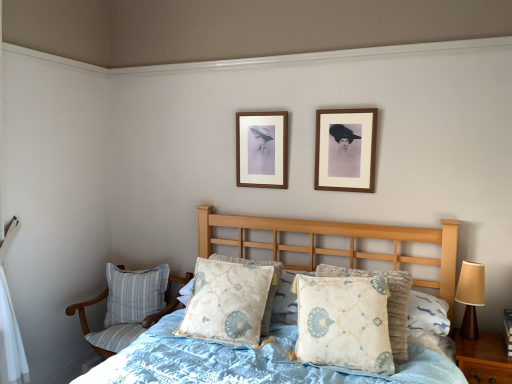
Find the location of a particular element. This screenshot has height=384, width=512. floral-patterned fabric pillow at center, which appears as the 1th pillow when viewed from the right is located at coordinates (344, 322).

The height and width of the screenshot is (384, 512). What do you see at coordinates (345, 149) in the screenshot? I see `wooden picture frame at upper center, the 1th picture frame from the right` at bounding box center [345, 149].

The height and width of the screenshot is (384, 512). What do you see at coordinates (129, 305) in the screenshot? I see `striped fabric chair at lower left` at bounding box center [129, 305].

Measure the distance between light blue quilted bed at center and camera.

They are 5.30 feet apart.

The image size is (512, 384). I want to click on floral-patterned fabric pillow at center, which appears as the 1th pillow when viewed from the right, so click(x=344, y=322).

From the image's perspective, is floral-patterned fabric pillow at center, the 2th pillow viewed from the back, on top of wooden picture frame at upper center, the 2th picture frame in the right-to-left sequence?

No, from the image's perspective, floral-patterned fabric pillow at center, the 2th pillow viewed from the back, is not on top of wooden picture frame at upper center, the 2th picture frame in the right-to-left sequence.

From a real-world perspective, is floral-patterned fabric pillow at center, the second pillow from the right, physically located above or below wooden picture frame at upper center, the 2th picture frame in the right-to-left sequence?

From a real-world perspective, floral-patterned fabric pillow at center, the second pillow from the right, is physically below wooden picture frame at upper center, the 2th picture frame in the right-to-left sequence.

Considering the relative positions of floral-patterned fabric pillow at center, the 2th pillow from the front, and wooden picture frame at upper center, the 1th picture frame viewed from the left, in the image provided, is floral-patterned fabric pillow at center, the 2th pillow from the front, behind wooden picture frame at upper center, the 1th picture frame viewed from the left,?

No, the depth of floral-patterned fabric pillow at center, the 2th pillow from the front, is less than that of wooden picture frame at upper center, the 1th picture frame viewed from the left.

Considering the sizes of objects floral-patterned fabric pillow at center, the 2th pillow from the front, and wooden picture frame at upper center, the second picture frame when ordered from front to back, in the image provided, who is thinner, floral-patterned fabric pillow at center, the 2th pillow from the front, or wooden picture frame at upper center, the second picture frame when ordered from front to back,?

With smaller width is wooden picture frame at upper center, the second picture frame when ordered from front to back.

Considering the relative sizes of wooden picture frame at upper center, placed as the first picture frame when sorted from back to front, and floral-patterned fabric pillow at center, the 2th pillow positioned from the left, in the image provided, is wooden picture frame at upper center, placed as the first picture frame when sorted from back to front, shorter than floral-patterned fabric pillow at center, the 2th pillow positioned from the left,?

In fact, wooden picture frame at upper center, placed as the first picture frame when sorted from back to front, may be taller than floral-patterned fabric pillow at center, the 2th pillow positioned from the left.

You are a GUI agent. You are given a task and a screenshot of the screen. Output one action in this format:
    pyautogui.click(x=<x>, y=<y>)
    Task: Click on the 1st pillow in front when counting from the wooden picture frame at upper center, the 2th picture frame in the right-to-left sequence
    The width and height of the screenshot is (512, 384).
    Given the screenshot: What is the action you would take?
    pyautogui.click(x=227, y=302)

Is there a large distance between wooden picture frame at upper center, the second picture frame when ordered from front to back, and floral-patterned fabric pillow at center, the 2th pillow positioned from the left?

Actually, wooden picture frame at upper center, the second picture frame when ordered from front to back, and floral-patterned fabric pillow at center, the 2th pillow positioned from the left, are a little close together.

Which object is positioned more to the right, light blue quilted bed at center or floral-patterned fabric pillow at center, the second pillow from the right?

From the viewer's perspective, light blue quilted bed at center appears more on the right side.

Locate an element on the screen. This screenshot has height=384, width=512. bed below the floral-patterned fabric pillow at center, the second pillow from the right (from the image's perspective) is located at coordinates (245, 362).

Between light blue quilted bed at center and floral-patterned fabric pillow at center, the second pillow from the right, which one is positioned in front?

light blue quilted bed at center is closer to the camera.

Is light blue quilted bed at center looking in the opposite direction of floral-patterned fabric pillow at center, the 2th pillow viewed from the back?

Yes, light blue quilted bed at center's orientation is away from floral-patterned fabric pillow at center, the 2th pillow viewed from the back.

Is striped fabric chair at lower left next to brown matte table lamp at right?

striped fabric chair at lower left is not next to brown matte table lamp at right, and they're not touching.

Is point (146, 323) behind point (460, 277)?

That is True.

Which object is positioned more to the right, striped fabric chair at lower left or brown matte table lamp at right?

From the viewer's perspective, brown matte table lamp at right appears more on the right side.

Looking at this image, is wooden picture frame at upper center, acting as the second picture frame starting from the left, to the right of striped fabric chair at lower left from the viewer's perspective?

Yes, wooden picture frame at upper center, acting as the second picture frame starting from the left, is to the right of striped fabric chair at lower left.

Are wooden picture frame at upper center, which is the first picture frame from front to back, and striped fabric chair at lower left beside each other?

No, wooden picture frame at upper center, which is the first picture frame from front to back, is not making contact with striped fabric chair at lower left.

Could you tell me if wooden picture frame at upper center, which is the first picture frame from front to back, is turned towards striped fabric chair at lower left?

No, wooden picture frame at upper center, which is the first picture frame from front to back, is not aimed at striped fabric chair at lower left.

Between wooden picture frame at upper center, which is the first picture frame from front to back, and striped fabric chair at lower left, which one has larger size?

striped fabric chair at lower left is bigger.

Considering the positions of points (138, 278) and (265, 368), is point (138, 278) closer to camera compared to point (265, 368)?

No.

In the scene shown: Is blue striped fabric pillow at lower left, marked as the 3th pillow in a right-to-left arrangement, next to light blue quilted bed at center?

blue striped fabric pillow at lower left, marked as the 3th pillow in a right-to-left arrangement, is not next to light blue quilted bed at center, and they're not touching.

Do you think blue striped fabric pillow at lower left, which ranks as the 1th pillow in left-to-right order, is within light blue quilted bed at center, or outside of it?

The correct answer is: outside.

Find the location of a particular element. The width and height of the screenshot is (512, 384). pillow below the light blue quilted bed at center (from the image's perspective) is located at coordinates (134, 293).

Is floral-patterned fabric pillow at center, the 1th pillow from the front, oriented away from blue striped fabric pillow at lower left, acting as the 1th pillow starting from the back?

No, floral-patterned fabric pillow at center, the 1th pillow from the front, is not facing away from blue striped fabric pillow at lower left, acting as the 1th pillow starting from the back.

From a real-world perspective, which is physically below, floral-patterned fabric pillow at center, which appears as the 1th pillow when viewed from the right, or blue striped fabric pillow at lower left, marked as the third pillow in a front-to-back arrangement?

blue striped fabric pillow at lower left, marked as the third pillow in a front-to-back arrangement, from a real-world perspective.

Which point is more forward, (362, 317) or (132, 285)?

The point (362, 317) is closer to the camera.

Considering the sizes of objects floral-patterned fabric pillow at center, which is the third pillow in left-to-right order, and blue striped fabric pillow at lower left, acting as the 1th pillow starting from the back, in the image provided, who is shorter, floral-patterned fabric pillow at center, which is the third pillow in left-to-right order, or blue striped fabric pillow at lower left, acting as the 1th pillow starting from the back,?

blue striped fabric pillow at lower left, acting as the 1th pillow starting from the back.

Starting from the floral-patterned fabric pillow at center, the 2th pillow positioned from the left, which picture frame is the 2nd one behind? Please provide its 2D coordinates.

[(262, 149)]

Identify the location of the 2nd pillow positioned below the wooden picture frame at upper center, the 2th picture frame in the right-to-left sequence (from a real-world perspective). (227, 302).

Estimate the real-world distances between objects in this image. Which object is closer to wooden picture frame at upper center, the 2th picture frame in the right-to-left sequence, blue striped fabric pillow at lower left, marked as the 3th pillow in a right-to-left arrangement, or floral-patterned fabric pillow at center, which is the third pillow in left-to-right order?

Among the two, floral-patterned fabric pillow at center, which is the third pillow in left-to-right order, is located nearer to wooden picture frame at upper center, the 2th picture frame in the right-to-left sequence.

From the image, which object appears to be nearer to blue striped fabric pillow at lower left, marked as the third pillow in a front-to-back arrangement, floral-patterned fabric pillow at center, the 2th pillow viewed from the back, or light blue quilted bed at center?

Among the two, light blue quilted bed at center is located nearer to blue striped fabric pillow at lower left, marked as the third pillow in a front-to-back arrangement.

Based on the photo, which object lies nearer to the anchor point light blue quilted bed at center, floral-patterned fabric pillow at center, the 2th pillow positioned from the left, or brown matte table lamp at right?

Among the two, floral-patterned fabric pillow at center, the 2th pillow positioned from the left, is located nearer to light blue quilted bed at center.

Based on their spatial positions, is floral-patterned fabric pillow at center, which is counted as the third pillow, starting from the back, or wooden picture frame at upper center, the 1th picture frame from the right, further from floral-patterned fabric pillow at center, the second pillow from the right?

wooden picture frame at upper center, the 1th picture frame from the right, is further to floral-patterned fabric pillow at center, the second pillow from the right.

Which object lies nearer to the anchor point light blue quilted bed at center, blue striped fabric pillow at lower left, marked as the third pillow in a front-to-back arrangement, or floral-patterned fabric pillow at center, which appears as the 1th pillow when viewed from the right?

floral-patterned fabric pillow at center, which appears as the 1th pillow when viewed from the right, lies closer to light blue quilted bed at center than the other object.

Considering their positions, is brown matte table lamp at right positioned closer to floral-patterned fabric pillow at center, the 2th pillow from the front, than striped fabric chair at lower left?

striped fabric chair at lower left.

Estimate the real-world distances between objects in this image. Which object is further from wooden picture frame at upper center, the 1th picture frame viewed from the left, floral-patterned fabric pillow at center, the 1th pillow from the front, or light blue quilted bed at center?

light blue quilted bed at center is further to wooden picture frame at upper center, the 1th picture frame viewed from the left.

When comparing their distances from floral-patterned fabric pillow at center, the second pillow from the right, does floral-patterned fabric pillow at center, the 1th pillow from the front, or light blue quilted bed at center seem closer?

light blue quilted bed at center is positioned closer to the anchor floral-patterned fabric pillow at center, the second pillow from the right.

At what (x,y) coordinates should I click in order to perform the action: click on picture frame between wooden picture frame at upper center, the 2th picture frame in the right-to-left sequence, and floral-patterned fabric pillow at center, which is the third pillow in left-to-right order, in the up-down direction. Please return your answer as a coordinate pair (x, y). This screenshot has height=384, width=512. Looking at the image, I should click on (345, 149).

You are a GUI agent. You are given a task and a screenshot of the screen. Output one action in this format:
    pyautogui.click(x=<x>, y=<y>)
    Task: Click on the table lamp between light blue quilted bed at center and floral-patterned fabric pillow at center, the 2th pillow from the front, from front to back
    
    Given the screenshot: What is the action you would take?
    pyautogui.click(x=471, y=296)

Where is `pillow between striped fabric chair at lower left and floral-patterned fabric pillow at center, the 1th pillow from the front`? The width and height of the screenshot is (512, 384). pillow between striped fabric chair at lower left and floral-patterned fabric pillow at center, the 1th pillow from the front is located at coordinates (227, 302).

Find the location of a particular element. The image size is (512, 384). pillow between light blue quilted bed at center and brown matte table lamp at right from front to back is located at coordinates (344, 322).